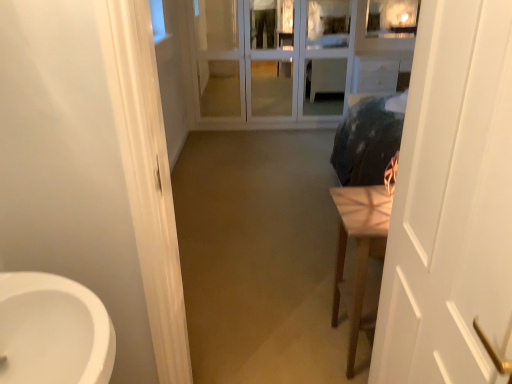
Question: In the image, is white glass screen door at center positioned in front of or behind white matte door at right?

Choices:
 (A) behind
 (B) front

Answer: (A)

Question: Considering the positions of white glass screen door at center and white matte door at right in the image, is white glass screen door at center wider or thinner than white matte door at right?

Choices:
 (A) thin
 (B) wide

Answer: (B)

Question: Estimate the real-world distances between objects in this image. Which object is farther from the white glass screen door at center?

Choices:
 (A) white matte door at right
 (B) light brown wooden table at right

Answer: (A)

Question: Which object is positioned closest to the white glass screen door at center?

Choices:
 (A) light brown wooden table at right
 (B) white matte door at right

Answer: (A)